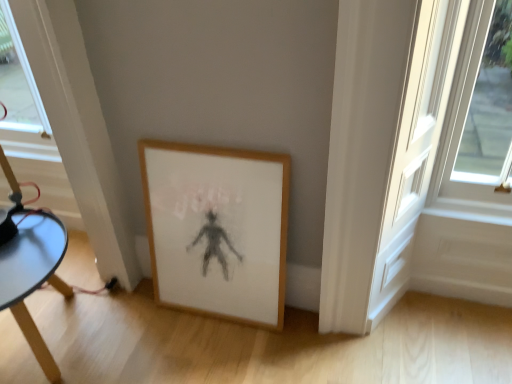
This screenshot has width=512, height=384. Find the location of `vacant area that lies to the right of wooden table at lower left`. vacant area that lies to the right of wooden table at lower left is located at coordinates (147, 342).